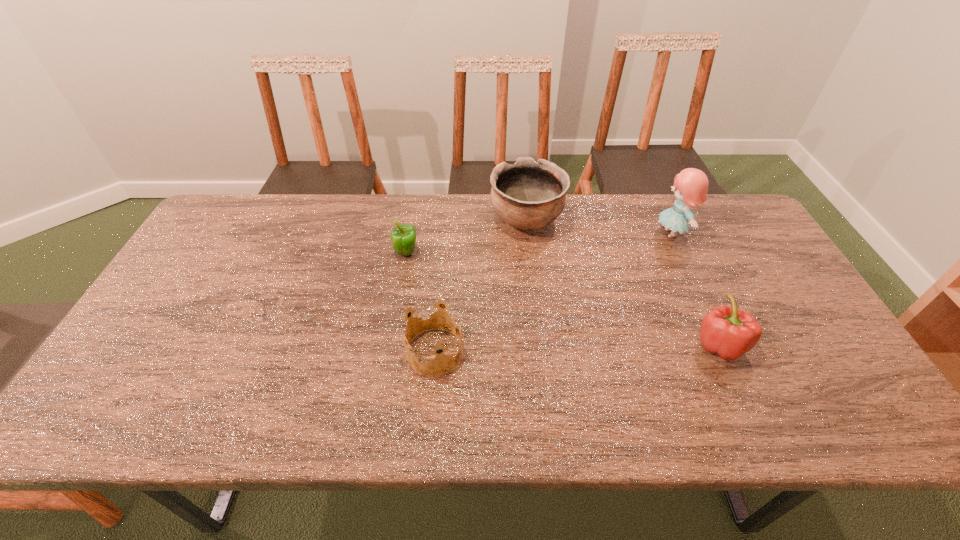
Find the location of a particular element. This screenshot has width=960, height=540. free space between the doll and the right bell pepper is located at coordinates pos(695,289).

What are the coordinates of `object that can be found as the fourth closest to the right bell pepper` in the screenshot? It's located at (403, 238).

Point out which object is positioned as the nearest to the tallest object. Please provide its 2D coordinates. Your answer should be formatted as a tuple, i.e. [(x, y)], where the tuple contains the x and y coordinates of a point satisfying the conditions above.

[(726, 331)]

Where is `free spot that satisfies the following two spatial constraints: 1. on the front-facing side of the doll; 2. on the front side of the second object from left to right`? free spot that satisfies the following two spatial constraints: 1. on the front-facing side of the doll; 2. on the front side of the second object from left to right is located at coordinates (726, 352).

Find the location of a particular element. The height and width of the screenshot is (540, 960). free space in the image that satisfies the following two spatial constraints: 1. on the front-facing side of the tallest object; 2. on the front side of the crown is located at coordinates (726, 352).